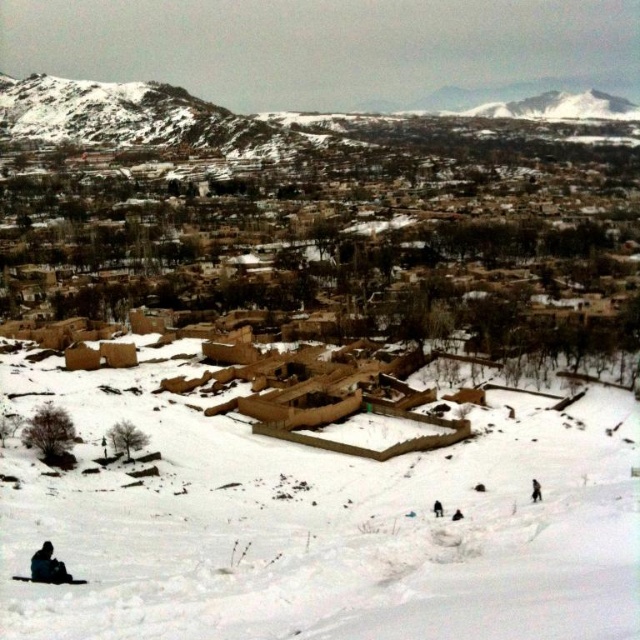
In the scene shown: You are standing at the center of the snowy village. You need to locate the brown fur coat at lower right. Which direction should you face to see it?

To locate the brown fur coat at lower right, you should face towards the lower right direction from your current position at the center of the snowy village.

You are standing in the snowy village and need to identify which of the two figures is closer to you based on their height. Which one is taller? The dark fabric figure at lower left or the brown fur coat at lower right?

The dark fabric figure at lower left is taller than the brown fur coat at lower right.